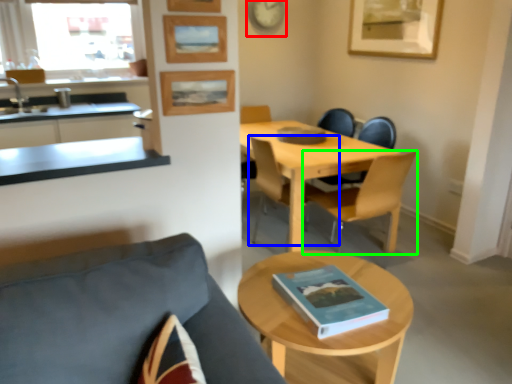
Question: Based on their relative distances, which object is nearer to clock (highlighted by a red box)? Choose from chair (highlighted by a blue box) and chair (highlighted by a green box).

Choices:
 (A) chair
 (B) chair

Answer: (A)